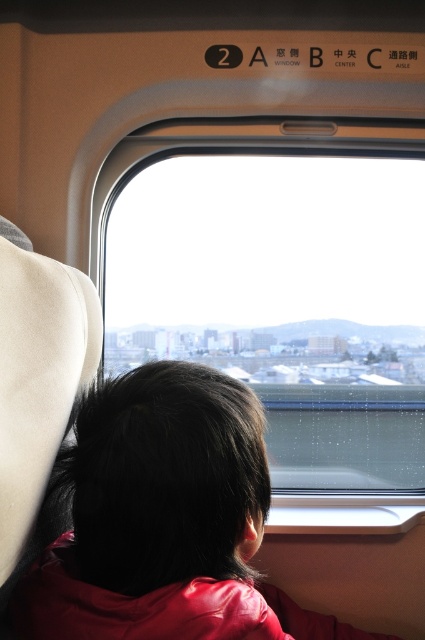
Between transparent glass window at center and red leather jacket at center, which one has more height?

Standing taller between the two is transparent glass window at center.

Is transparent glass window at center closer to camera compared to red leather jacket at center?

That is False.

Image resolution: width=425 pixels, height=640 pixels. In order to click on transparent glass window at center in this screenshot , I will do `click(282, 296)`.

Where is `transparent glass window at center`? transparent glass window at center is located at coordinates (282, 296).